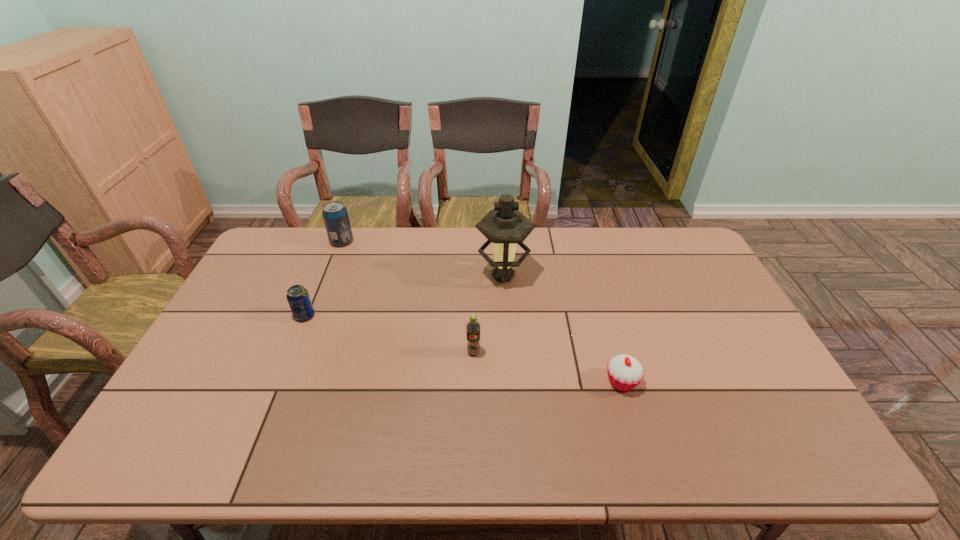
At what (x,y) coordinates should I click in order to perform the action: click on oil lamp. Please return your answer as a coordinate pair (x, y). Looking at the image, I should click on (505, 226).

Where is `the fourth nearest object`? This screenshot has height=540, width=960. the fourth nearest object is located at coordinates (505, 226).

This screenshot has height=540, width=960. Find the location of `the farthest soda`. the farthest soda is located at coordinates (335, 215).

At what (x,y) coordinates should I click in order to perform the action: click on the rightmost soda. Please return your answer as a coordinate pair (x, y). Looking at the image, I should click on (473, 327).

Where is `the nearest soda`? the nearest soda is located at coordinates (473, 327).

Where is `the second nearest soda`? The height and width of the screenshot is (540, 960). the second nearest soda is located at coordinates (298, 297).

Identify the location of the third nearest object. This screenshot has width=960, height=540. (298, 297).

I want to click on the rightmost object, so click(625, 372).

I want to click on cupcake, so click(625, 372).

Identify the location of free space located on the right of the oil lamp. (582, 275).